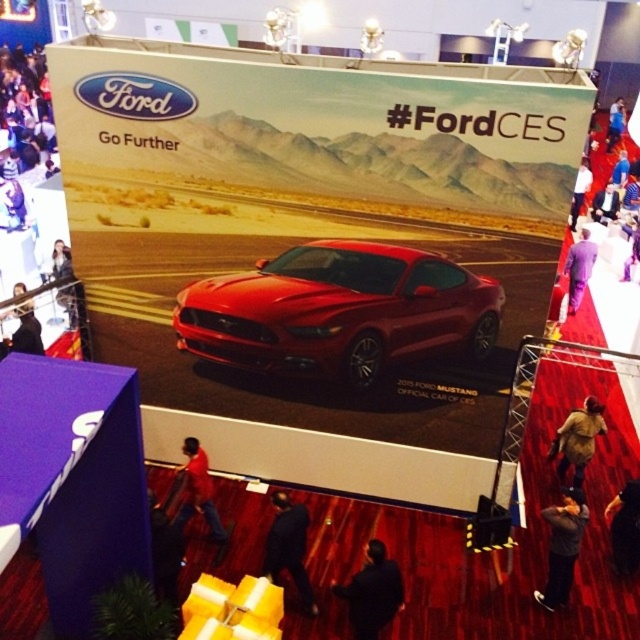
You are a photographer at the Ford CES booth. You want to take a photo of the red shirt at center. Where should you position your camera to capture the shirt in the center of the photo?

To capture the red shirt at center in the center of the photo, position your camera at the point corresponding to the shirt location, which is at coordinates (195, 492).

You are an attendee at the Ford CES booth and notice two items at the center of the display. The dark blue fabric at center and the red shirt at center. Which one is bigger?

The dark blue fabric at center has a larger size compared to the red shirt at center.

You are a photographer at the Ford CES booth and need to capture a photo that includes both the dark blue fabric at center and the red shirt at center. What is the minimum distance you need to move backward to ensure both objects are in frame?

The dark blue fabric at center and the red shirt at center are 2.23 meters apart from each other. To capture both in frame, you need to move back at least 2.23 meters to ensure the camera can encompass the entire distance between them.